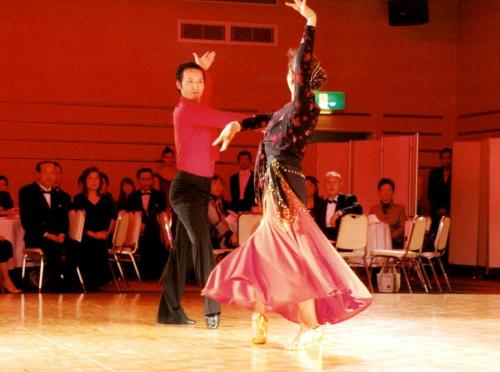
Find the location of a particular element. doorway is located at coordinates (336, 138).